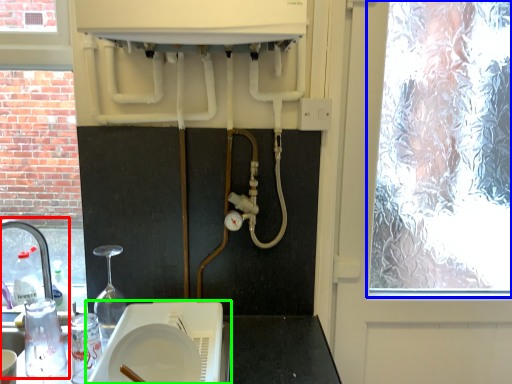
Question: Which object is positioned farthest from sink (highlighted by a red box)? Select from window (highlighted by a blue box) and appliance (highlighted by a green box).

Choices:
 (A) window
 (B) appliance

Answer: (A)